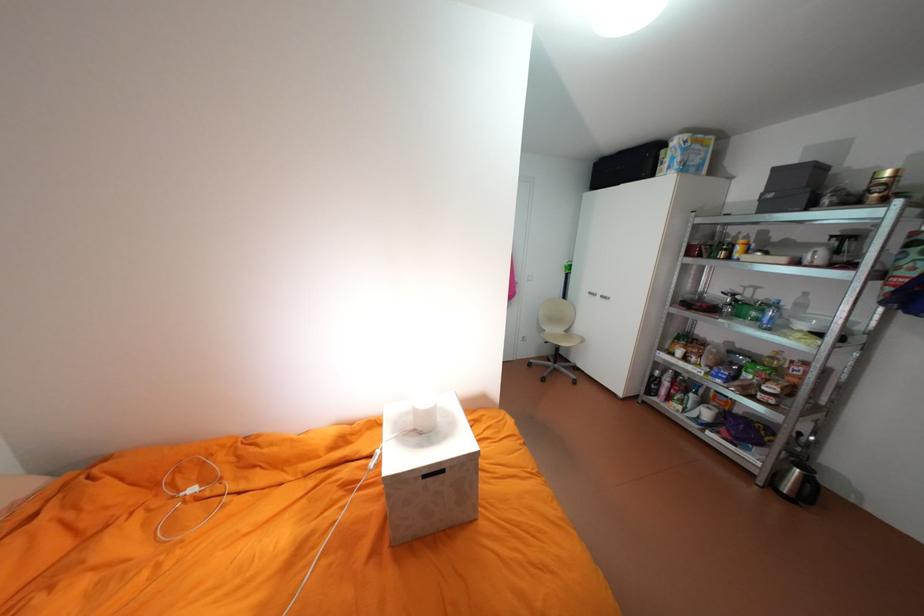
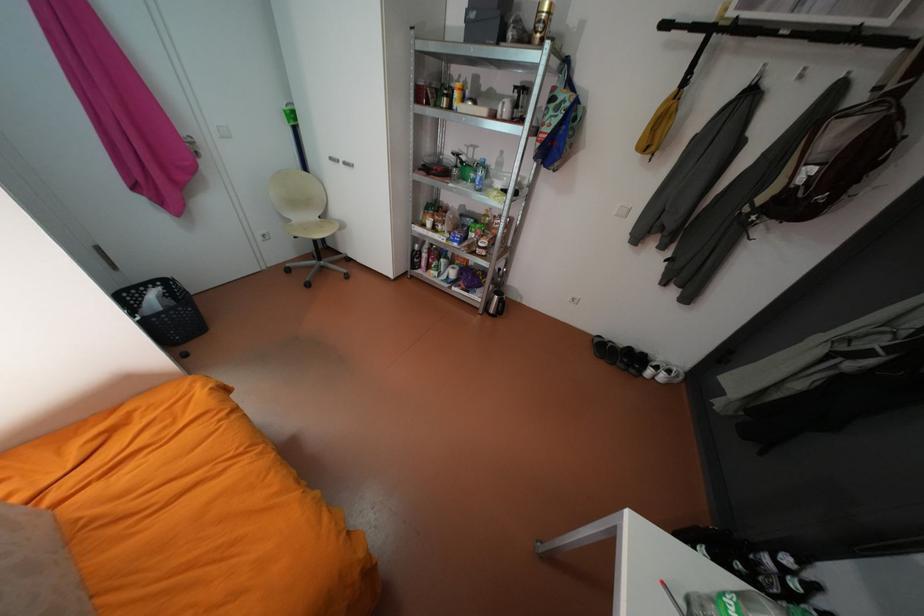
Where in the second image is the point corresponding to (x=762, y=475) from the first image?

(487, 308)